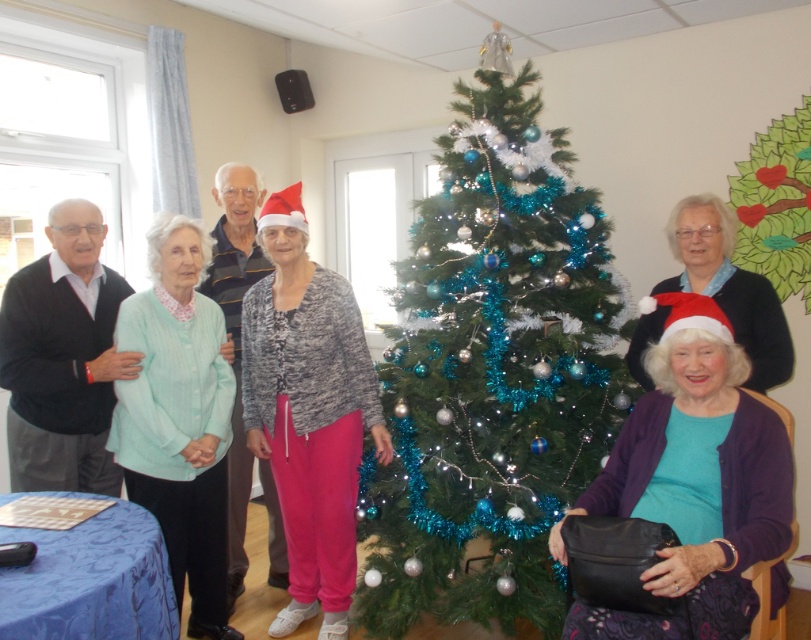
Does point (195, 509) lie in front of point (88, 312)?

Yes.

Is light green knitted sweater at left positioned in front of black sweater at left?

Yes.

Find the location of a particular element. light green knitted sweater at left is located at coordinates (178, 419).

Which is in front, point (136, 349) or point (189, 280)?

Point (136, 349)

Can you confirm if light green knitted sweater at left is shorter than matte black sweater at center?

Correct, light green knitted sweater at left is not as tall as matte black sweater at center.

The height and width of the screenshot is (640, 811). I want to click on light green knitted sweater at left, so click(x=178, y=419).

Does green artificial christmas tree at center appear on the right side of purple soft sweater at center?

Incorrect, green artificial christmas tree at center is not on the right side of purple soft sweater at center.

Is point (466, 497) positioned behind point (704, 300)?

That is True.

This screenshot has height=640, width=811. In order to click on green artificial christmas tree at center in this screenshot , I will do `click(492, 371)`.